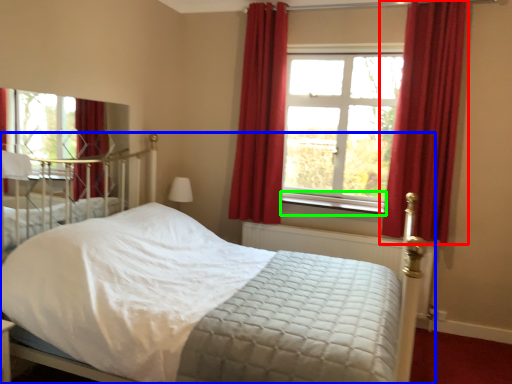
Question: Considering the real-world distances, which object is farthest from curtain (highlighted by a red box)? bed (highlighted by a blue box) or window sill (highlighted by a green box)?

Choices:
 (A) bed
 (B) window sill

Answer: (B)